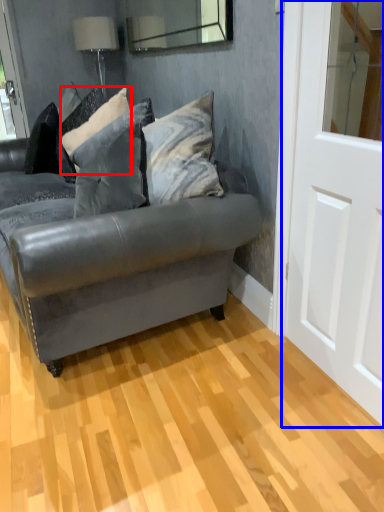
Question: Among these objects, which one is nearest to the camera, pillow (highlighted by a red box) or screen door (highlighted by a blue box)?

Choices:
 (A) pillow
 (B) screen door

Answer: (B)